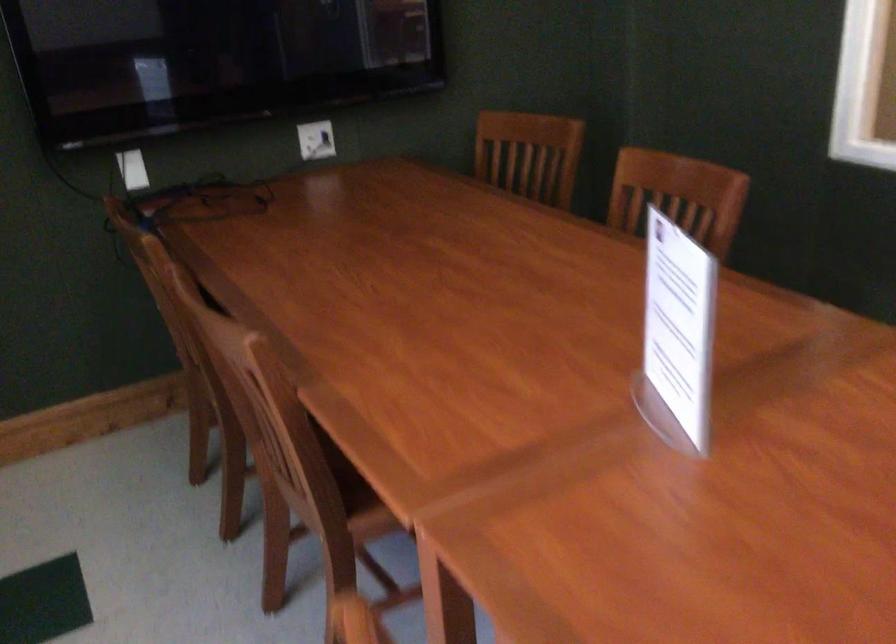
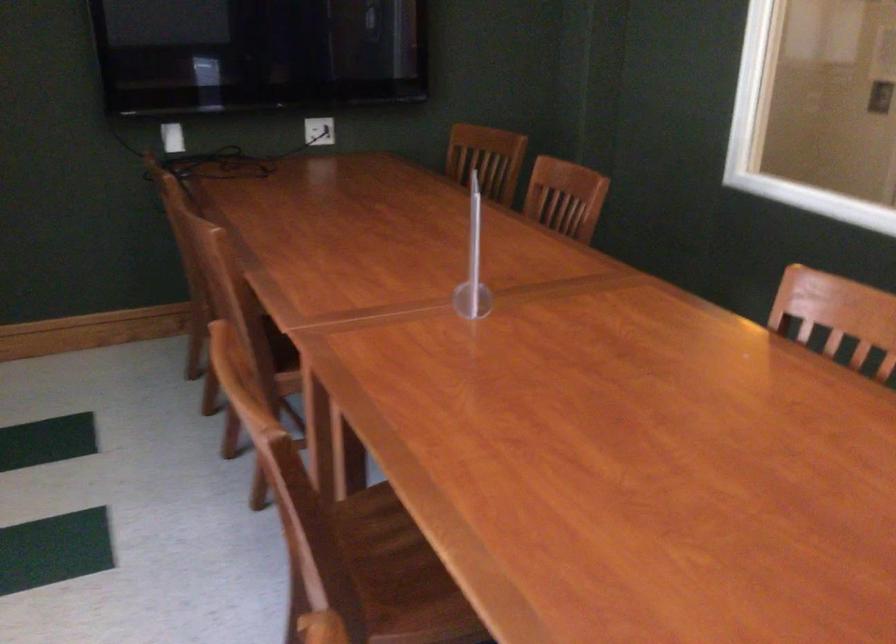
Question: I am providing you with two images of the same scene from different viewpoints. After the viewpoint changes to image2, which objects are now occluded?

Choices:
 (A) wooden chair seat
 (B) wrapped black object
 (C) tabletop sign holder
 (D) transparent sign holder

Answer: (C)